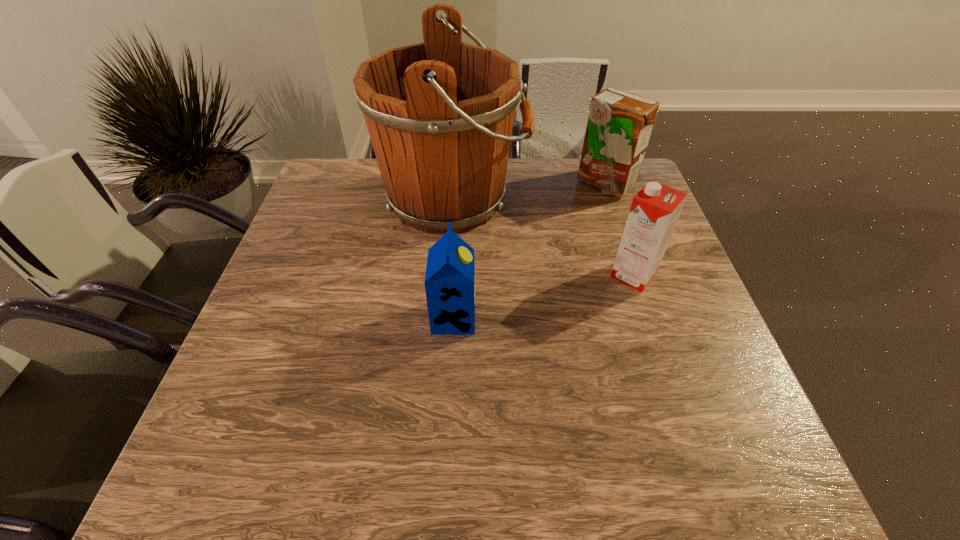
The width and height of the screenshot is (960, 540). I want to click on free spot that satisfies the following two spatial constraints: 1. on the back side of the third farthest object; 2. with the handle on the side of the bucket, so click(x=608, y=199).

You are a GUI agent. You are given a task and a screenshot of the screen. Output one action in this format:
    pyautogui.click(x=<x>, y=<y>)
    Task: Click on the vacant space that satisfies the following two spatial constraints: 1. on the front side of the second nearest object; 2. with the cap open on the leftmost carton
    The height and width of the screenshot is (540, 960).
    Given the screenshot: What is the action you would take?
    pyautogui.click(x=648, y=318)

Where is `vacant area that satisfies the following two spatial constraints: 1. on the straw side of the farthest carton; 2. with the cap open on the nearest object`? The image size is (960, 540). vacant area that satisfies the following two spatial constraints: 1. on the straw side of the farthest carton; 2. with the cap open on the nearest object is located at coordinates (651, 318).

Locate an element on the screen. Image resolution: width=960 pixels, height=540 pixels. vacant point that satisfies the following two spatial constraints: 1. on the straw side of the farthest carton; 2. with the cap open on the leftmost carton is located at coordinates click(651, 318).

Identify the location of blank space that satisfies the following two spatial constraints: 1. with the handle on the side of the bucket; 2. on the right side of the second nearest object. The image size is (960, 540). (447, 275).